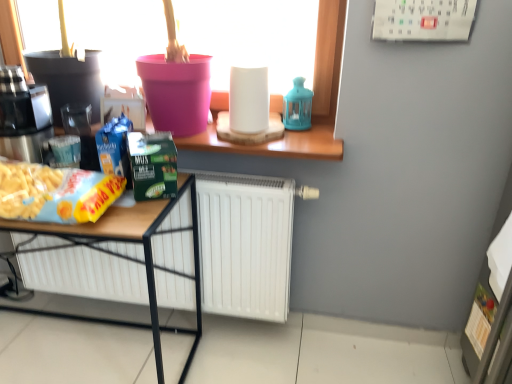
Describe the element at coordinates (23, 116) in the screenshot. I see `brushed metal coffee machine at left` at that location.

Find the location of `wooden desk at lower left`. wooden desk at lower left is located at coordinates (127, 255).

This screenshot has height=384, width=512. What do you see at coordinates (313, 102) in the screenshot? I see `pink plastic bucket at upper center` at bounding box center [313, 102].

I want to click on brushed metal coffee machine at left, so click(23, 116).

Considering the positions of point (72, 195) and point (289, 136), is point (72, 195) closer or farther from the camera than point (289, 136)?

Clearly, point (72, 195) is closer to the camera than point (289, 136).

Does yellow matte snack packet at lower left have a lesser width compared to pink plastic bucket at upper center?

Indeed, yellow matte snack packet at lower left has a lesser width compared to pink plastic bucket at upper center.

Considering the positions of objects yellow matte snack packet at lower left and pink plastic bucket at upper center in the image provided, who is more to the left, yellow matte snack packet at lower left or pink plastic bucket at upper center?

From the viewer's perspective, yellow matte snack packet at lower left appears more on the left side.

Does point (106, 205) come closer to viewer compared to point (153, 331)?

Yes, it is in front of point (153, 331).

Is yellow matte snack packet at lower left turned away from wooden desk at lower left?

That's not correct — yellow matte snack packet at lower left is not looking away from wooden desk at lower left.

From a real-world perspective, which is physically below, yellow matte snack packet at lower left or wooden desk at lower left?

wooden desk at lower left is physically lower.

Is brushed metal coffee machine at left far away from pink plastic bucket at upper center?

No, brushed metal coffee machine at left is not far away from pink plastic bucket at upper center.

Is brushed metal coffee machine at left not inside pink plastic bucket at upper center?

That's incorrect, brushed metal coffee machine at left is not completely outside pink plastic bucket at upper center.

Between brushed metal coffee machine at left and pink plastic bucket at upper center, which one has larger size?

With larger size is pink plastic bucket at upper center.

Which of these two, brushed metal coffee machine at left or pink plastic bucket at upper center, is thinner?

brushed metal coffee machine at left is thinner.

Is wooden desk at lower left at the right side of yellow matte snack packet at lower left?

No, wooden desk at lower left is not to the right of yellow matte snack packet at lower left.

How far apart are wooden desk at lower left and yellow matte snack packet at lower left?

wooden desk at lower left and yellow matte snack packet at lower left are 8.19 inches apart.

From the image's perspective, is wooden desk at lower left below yellow matte snack packet at lower left?

Yes, from the image's perspective, wooden desk at lower left is below yellow matte snack packet at lower left.

Is the surface of wooden desk at lower left in direct contact with yellow matte snack packet at lower left?

No, wooden desk at lower left is not next to yellow matte snack packet at lower left.

Considering the sizes of objects wooden desk at lower left and brushed metal coffee machine at left in the image provided, who is bigger, wooden desk at lower left or brushed metal coffee machine at left?

Bigger between the two is wooden desk at lower left.

Who is shorter, wooden desk at lower left or brushed metal coffee machine at left?

brushed metal coffee machine at left.

You are a GUI agent. You are given a task and a screenshot of the screen. Output one action in this format:
    pyautogui.click(x=<x>, y=<y>)
    Task: Click on the coffee machine that is above the wooden desk at lower left (from the image's perspective)
    This screenshot has width=512, height=384.
    Given the screenshot: What is the action you would take?
    point(23,116)

Does pink plastic bucket at upper center have a smaller size compared to brushed metal coffee machine at left?

No, pink plastic bucket at upper center is not smaller than brushed metal coffee machine at left.

Is pink plastic bucket at upper center looking in the opposite direction of brushed metal coffee machine at left?

pink plastic bucket at upper center is not turned away from brushed metal coffee machine at left.

Considering the positions of objects pink plastic bucket at upper center and brushed metal coffee machine at left in the image provided, who is more to the right, pink plastic bucket at upper center or brushed metal coffee machine at left?

Positioned to the right is pink plastic bucket at upper center.

Does point (315, 150) lie in front of point (50, 113)?

Yes, it is.

From the image's perspective, would you say brushed metal coffee machine at left is positioned over yellow matte snack packet at lower left?

Correct, brushed metal coffee machine at left appears higher than yellow matte snack packet at lower left in the image.

From a real-world perspective, who is located higher, brushed metal coffee machine at left or yellow matte snack packet at lower left?

brushed metal coffee machine at left, from a real-world perspective.

Looking at this image, considering the sizes of brushed metal coffee machine at left and yellow matte snack packet at lower left in the image, is brushed metal coffee machine at left taller or shorter than yellow matte snack packet at lower left?

In the image, brushed metal coffee machine at left appears to be taller than yellow matte snack packet at lower left.

Is point (31, 111) more distant than point (19, 186)?

Yes, it is behind point (19, 186).

Identify the location of food located below the pink plastic bucket at upper center (from the image's perspective). (55, 193).

Locate an element on the screen. food positioned vertically above the wooden desk at lower left (from a real-world perspective) is located at coordinates (55, 193).

Based on their spatial positions, is yellow matte snack packet at lower left or brushed metal coffee machine at left closer to pink plastic bucket at upper center?

Among the two, yellow matte snack packet at lower left is located nearer to pink plastic bucket at upper center.

Looking at the image, which one is located closer to pink plastic bucket at upper center, yellow matte snack packet at lower left or wooden desk at lower left?

yellow matte snack packet at lower left lies closer to pink plastic bucket at upper center than the other object.

Looking at the image, which one is located closer to yellow matte snack packet at lower left, brushed metal coffee machine at left or wooden desk at lower left?

The object closer to yellow matte snack packet at lower left is wooden desk at lower left.

Considering their positions, is brushed metal coffee machine at left positioned further to yellow matte snack packet at lower left than pink plastic bucket at upper center?

pink plastic bucket at upper center.

From the image, which object appears to be farther from brushed metal coffee machine at left, yellow matte snack packet at lower left or wooden desk at lower left?

wooden desk at lower left is positioned further to the anchor brushed metal coffee machine at left.

Based on their spatial positions, is pink plastic bucket at upper center or wooden desk at lower left closer to yellow matte snack packet at lower left?

The object closer to yellow matte snack packet at lower left is wooden desk at lower left.

Looking at the image, which one is located further to wooden desk at lower left, yellow matte snack packet at lower left or pink plastic bucket at upper center?

pink plastic bucket at upper center.

When comparing their distances from yellow matte snack packet at lower left, does pink plastic bucket at upper center or brushed metal coffee machine at left seem closer?

The object closer to yellow matte snack packet at lower left is brushed metal coffee machine at left.

This screenshot has width=512, height=384. What are the coordinates of `food between pink plastic bucket at upper center and wooden desk at lower left in the vertical direction` in the screenshot? It's located at (55, 193).

The image size is (512, 384). I want to click on food between brushed metal coffee machine at left and wooden desk at lower left in the up-down direction, so click(55, 193).

Locate an element on the screen. The image size is (512, 384). coffee machine that lies between pink plastic bucket at upper center and wooden desk at lower left from top to bottom is located at coordinates (23, 116).

What are the coordinates of `food between brushed metal coffee machine at left and pink plastic bucket at upper center from left to right` in the screenshot? It's located at (55, 193).